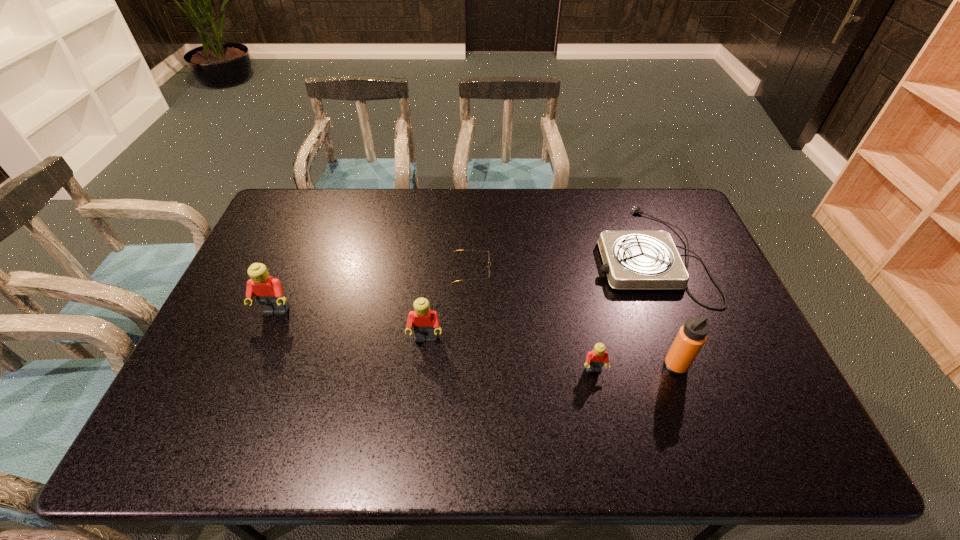
Identify the location of unoccupied position between the hotplate and the fourth object from right to left. pos(560,263).

Find the location of a particular element. This screenshot has width=960, height=540. free spot between the hotplate and the third object from left to right is located at coordinates (560, 263).

Find the location of `vacant area that lies between the hotplate and the farthest Lego`. vacant area that lies between the hotplate and the farthest Lego is located at coordinates (462, 283).

The width and height of the screenshot is (960, 540). Identify the location of vacant area between the nearest Lego and the spectacles. (533, 320).

Image resolution: width=960 pixels, height=540 pixels. I want to click on the closest object relative to the hotplate, so click(x=691, y=337).

Point out which object is positioned as the third nearest to the second Lego from left to right. Please provide its 2D coordinates. Your answer should be formatted as a tuple, i.e. [(x, y)], where the tuple contains the x and y coordinates of a point satisfying the conditions above.

[(595, 359)]

You are a GUI agent. You are given a task and a screenshot of the screen. Output one action in this format:
    pyautogui.click(x=<x>, y=<y>)
    Task: Click on the second closest Lego to the farthest Lego
    
    Given the screenshot: What is the action you would take?
    pyautogui.click(x=595, y=359)

Locate an element on the screen. Image resolution: width=960 pixels, height=540 pixels. Lego object that ranks as the closest to the fourth object from right to left is located at coordinates (425, 323).

Identify the location of vacant space that satisfies the following two spatial constraints: 1. on the face of the thermos bottle; 2. on the left side of the leftmost object. (253, 366).

Find the location of a particular element. This screenshot has height=540, width=960. vacant position in the image that satisfies the following two spatial constraints: 1. with a retractable cable on the side of the hotplate; 2. on the face of the leftmost Lego is located at coordinates (670, 312).